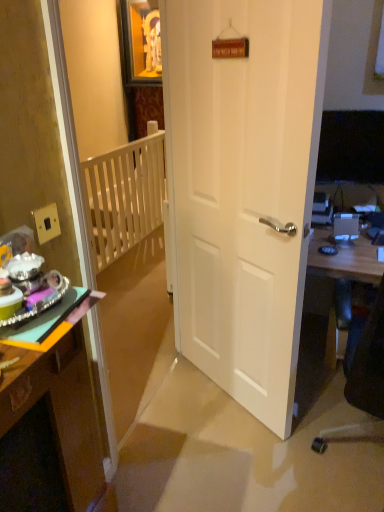
You are a GUI agent. You are given a task and a screenshot of the screen. Output one action in this format:
    pyautogui.click(x=<x>, y=<y>)
    Task: Click on the vacant region to the right of white wooden bunk bed at upper left
    The image size is (384, 512).
    Given the screenshot: What is the action you would take?
    pyautogui.click(x=215, y=411)